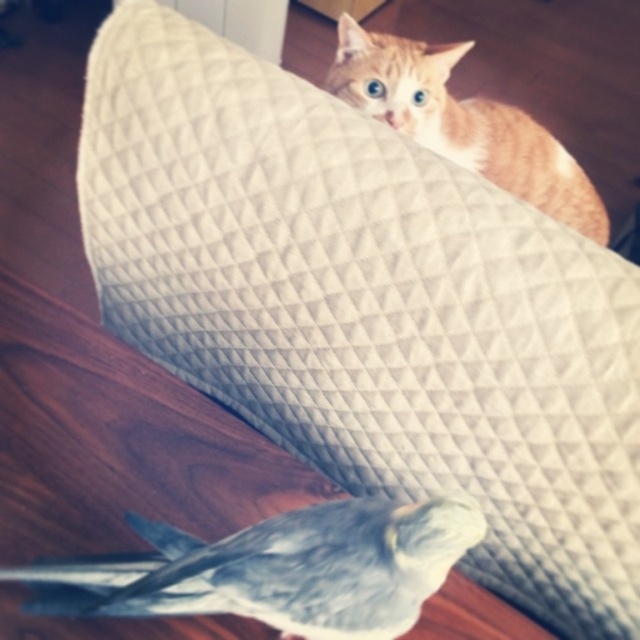
Question: Can you confirm if gray matte bird at lower left is positioned above orange fur cat at upper right?

Choices:
 (A) yes
 (B) no

Answer: (B)

Question: Does gray matte bird at lower left appear over orange fur cat at upper right?

Choices:
 (A) yes
 (B) no

Answer: (B)

Question: Does gray matte bird at lower left have a larger size compared to orange fur cat at upper right?

Choices:
 (A) no
 (B) yes

Answer: (A)

Question: Which object appears closest to the camera in this image?

Choices:
 (A) gray matte bird at lower left
 (B) orange fur cat at upper right

Answer: (A)

Question: Which object is farther from the camera taking this photo?

Choices:
 (A) orange fur cat at upper right
 (B) gray matte bird at lower left

Answer: (A)